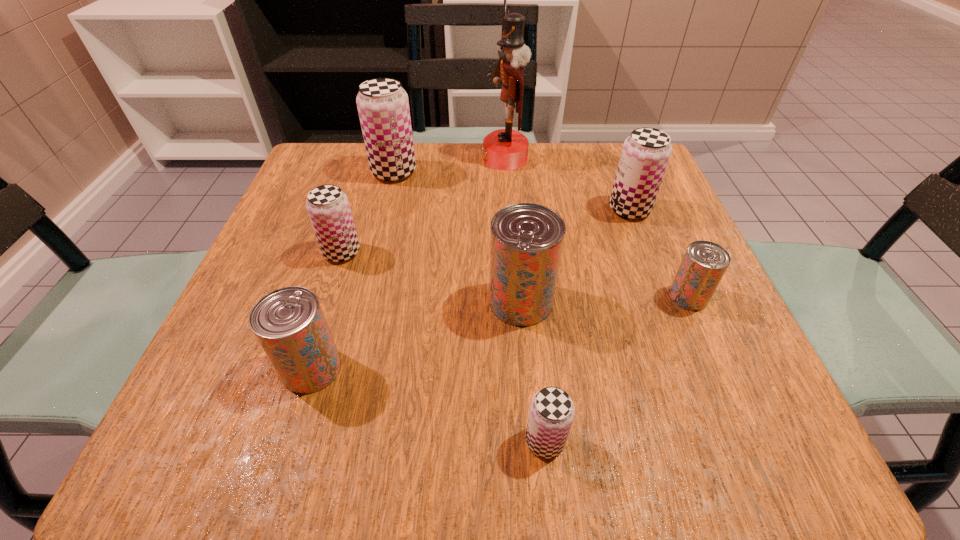
Image resolution: width=960 pixels, height=540 pixels. Find the location of `free location located 0.160m on the right of the second biggest red beer can`. free location located 0.160m on the right of the second biggest red beer can is located at coordinates (449, 368).

Locate an element on the screen. The height and width of the screenshot is (540, 960). vacant area situated on the back of the third farthest beer can is located at coordinates (359, 197).

The width and height of the screenshot is (960, 540). I want to click on vacant space located 0.380m on the left of the rightmost red beer can, so click(445, 296).

Identify the location of vacant area located 0.100m on the left of the nearest beer can. This screenshot has height=540, width=960. (448, 441).

Where is `nutcracker that is positioned at the far edge`? This screenshot has width=960, height=540. nutcracker that is positioned at the far edge is located at coordinates (505, 149).

Locate an element on the screen. object present at the near edge is located at coordinates (551, 413).

Where is `object that is at the far left corner`? The height and width of the screenshot is (540, 960). object that is at the far left corner is located at coordinates (383, 106).

You are a GUI agent. You are given a task and a screenshot of the screen. Output one action in this format:
    pyautogui.click(x=<x>, y=<y>)
    Task: Click on the object that is at the far right corner
    The height and width of the screenshot is (540, 960).
    Given the screenshot: What is the action you would take?
    pyautogui.click(x=646, y=152)

The image size is (960, 540). What are the coordinates of `vacant space at the far edge` in the screenshot? It's located at (471, 170).

Find the location of a particular element. The height and width of the screenshot is (540, 960). free region at the near edge of the desktop is located at coordinates click(658, 428).